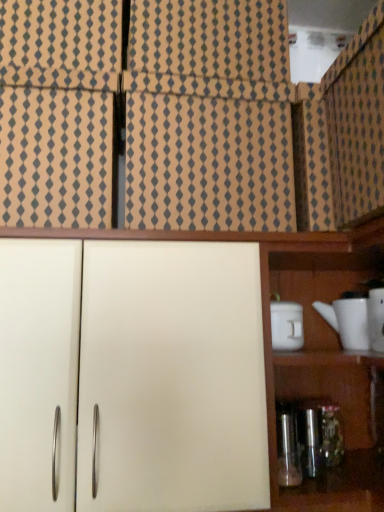
Question: Is white glossy teapot at right oriented away from patterned cardboard at upper left, which is counted as the second cabinetry, starting from the bottom?

Choices:
 (A) yes
 (B) no

Answer: (B)

Question: Does white glossy teapot at right have a larger size compared to patterned cardboard at upper left, which is counted as the second cabinetry, starting from the bottom?

Choices:
 (A) yes
 (B) no

Answer: (B)

Question: Can you confirm if white glossy teapot at right is wider than patterned cardboard at upper left, which is counted as the second cabinetry, starting from the bottom?

Choices:
 (A) no
 (B) yes

Answer: (A)

Question: Is white glossy teapot at right next to patterned cardboard at upper left, acting as the 1th cabinetry starting from the top, and touching it?

Choices:
 (A) yes
 (B) no

Answer: (B)

Question: Is white glossy teapot at right to the left of patterned cardboard at upper left, acting as the 1th cabinetry starting from the top, from the viewer's perspective?

Choices:
 (A) yes
 (B) no

Answer: (B)

Question: From the image's perspective, is white matte container at right positioned above or below beige textured tile at upper center?

Choices:
 (A) above
 (B) below

Answer: (B)

Question: From a real-world perspective, is white matte container at right above or below beige textured tile at upper center?

Choices:
 (A) above
 (B) below

Answer: (B)

Question: Considering the positions of white matte container at right and beige textured tile at upper center in the image, is white matte container at right bigger or smaller than beige textured tile at upper center?

Choices:
 (A) big
 (B) small

Answer: (B)

Question: In the image, is white matte container at right on the left side or the right side of beige textured tile at upper center?

Choices:
 (A) right
 (B) left

Answer: (A)

Question: Considering the relative positions of patterned cardboard at upper left, acting as the 1th cabinetry starting from the top, and beige textured tile at upper center in the image provided, is patterned cardboard at upper left, acting as the 1th cabinetry starting from the top, to the left or to the right of beige textured tile at upper center?

Choices:
 (A) left
 (B) right

Answer: (A)

Question: From the image's perspective, is patterned cardboard at upper left, which is counted as the second cabinetry, starting from the bottom, above or below beige textured tile at upper center?

Choices:
 (A) below
 (B) above

Answer: (B)

Question: Considering the positions of point (31, 103) and point (125, 214), is point (31, 103) closer or farther from the camera than point (125, 214)?

Choices:
 (A) closer
 (B) farther

Answer: (B)

Question: Would you say patterned cardboard at upper left, which is counted as the second cabinetry, starting from the bottom, is inside or outside beige textured tile at upper center?

Choices:
 (A) outside
 (B) inside

Answer: (A)

Question: Looking at the image, does metallic glass bottle at lower right seem bigger or smaller compared to white matte container at right?

Choices:
 (A) big
 (B) small

Answer: (B)

Question: Looking at their shapes, would you say metallic glass bottle at lower right is wider or thinner than white matte container at right?

Choices:
 (A) wide
 (B) thin

Answer: (B)